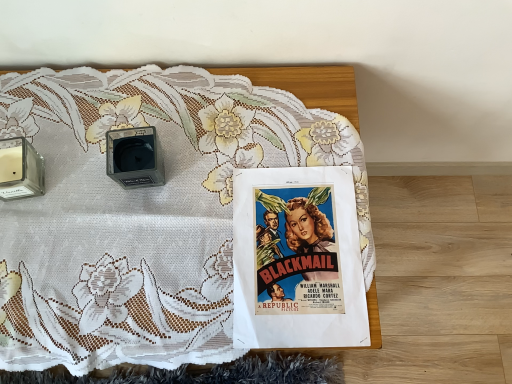
Image resolution: width=512 pixels, height=384 pixels. What are the coordinates of `free location to the right of matte black speaker at center, placed as the 1th speaker when sorted from right to left` in the screenshot? It's located at (222, 149).